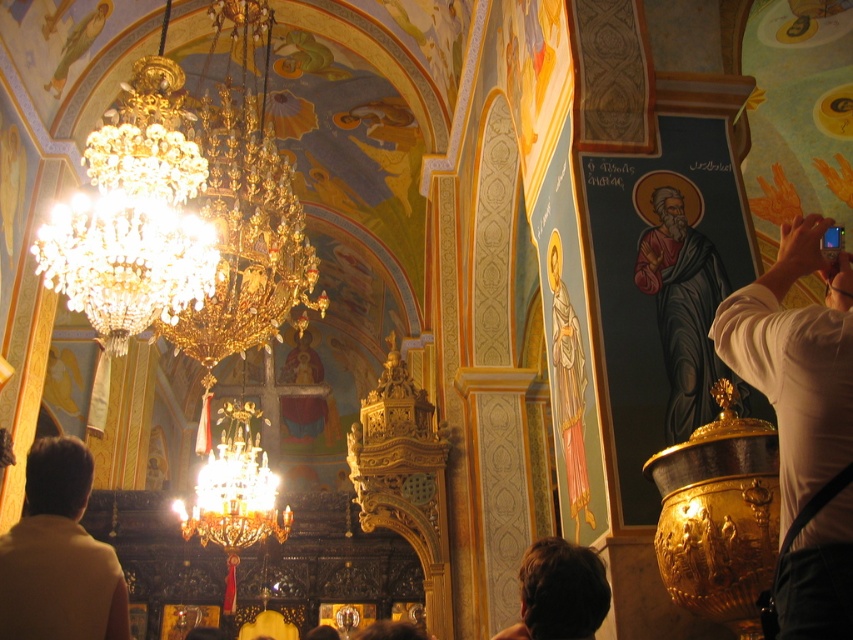
You are standing in the church and want to take a photo of the brown hair at lower center without the white shirt at right blocking the view. Is this possible?

The white shirt at right is in front of brown hair at lower center, so you cannot take a photo of the brown hair at lower center without the white shirt at right blocking the view.

You are standing in the church and want to take a photo of the chandelier. You notice two points marked in the image. Which point, point [727,353] or point [711,253], is closer to your camera lens?

Point [727,353] is closer to the camera lens than point [711,253].